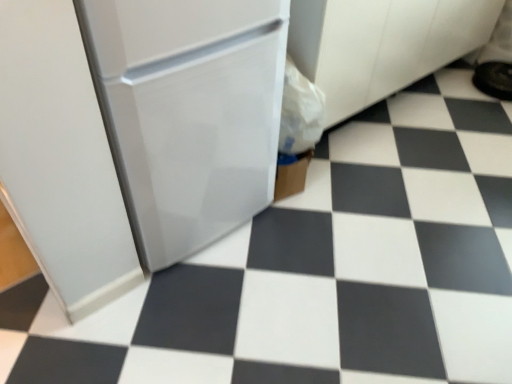
Question: From a real-world perspective, is white glossy refrigerator at center above or below black rubber shoe at upper right?

Choices:
 (A) above
 (B) below

Answer: (A)

Question: Is white glossy refrigerator at center in front of or behind black rubber shoe at upper right in the image?

Choices:
 (A) behind
 (B) front

Answer: (B)

Question: Is white glossy refrigerator at center to the left or to the right of black rubber shoe at upper right in the image?

Choices:
 (A) left
 (B) right

Answer: (A)

Question: Is black rubber shoe at upper right wider or thinner than white glossy refrigerator at center?

Choices:
 (A) thin
 (B) wide

Answer: (A)

Question: Considering the positions of point (479, 82) and point (266, 167), is point (479, 82) closer or farther from the camera than point (266, 167)?

Choices:
 (A) closer
 (B) farther

Answer: (B)

Question: Relative to white glossy refrigerator at center, is black rubber shoe at upper right in front or behind?

Choices:
 (A) behind
 (B) front

Answer: (A)

Question: Is black rubber shoe at upper right inside or outside of white glossy refrigerator at center?

Choices:
 (A) outside
 (B) inside

Answer: (A)